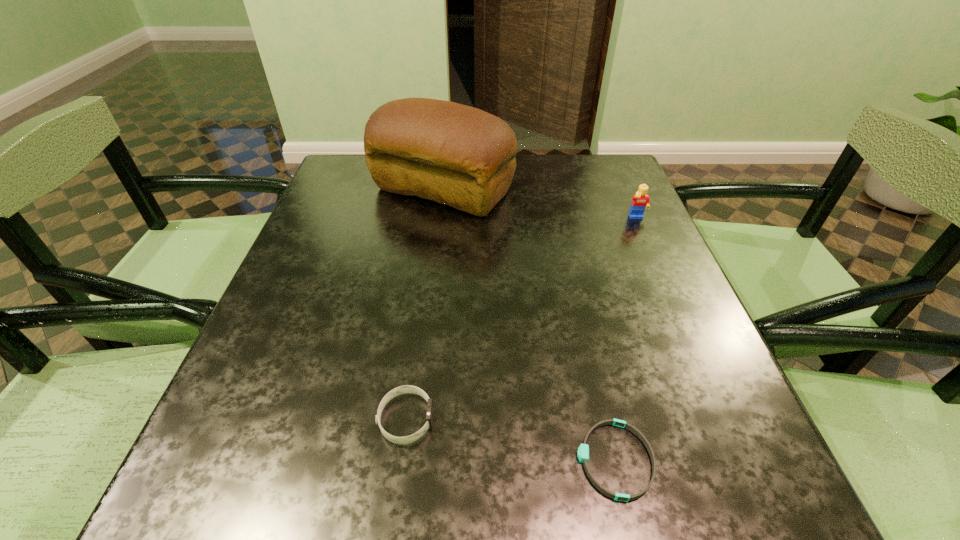
Identify the location of vacant area that lies between the second tallest object and the shorter wristband. The height and width of the screenshot is (540, 960). (626, 339).

Where is `vacant area that lies between the rightmost object and the second object from right to left`? The height and width of the screenshot is (540, 960). vacant area that lies between the rightmost object and the second object from right to left is located at coordinates (626, 339).

At what (x,y) coordinates should I click in order to perform the action: click on unoccupied area between the right wristband and the tallest object. Please return your answer as a coordinate pair (x, y). Looking at the image, I should click on (529, 325).

Locate an element on the screen. Image resolution: width=960 pixels, height=540 pixels. the closest object relative to the left wristband is located at coordinates (583, 451).

Identify which object is located as the nearest to the taller wristband. Please provide its 2D coordinates. Your answer should be formatted as a tuple, i.e. [(x, y)], where the tuple contains the x and y coordinates of a point satisfying the conditions above.

[(583, 451)]

Where is `free space in the image that satisfies the following two spatial constraints: 1. on the face of the third shortest object; 2. on the outer surface of the taller wristband`? Image resolution: width=960 pixels, height=540 pixels. free space in the image that satisfies the following two spatial constraints: 1. on the face of the third shortest object; 2. on the outer surface of the taller wristband is located at coordinates (726, 419).

This screenshot has height=540, width=960. I want to click on free point that satisfies the following two spatial constraints: 1. on the face of the second tallest object; 2. on the outer surface of the taller wristband, so click(x=726, y=419).

Locate an element on the screen. This screenshot has height=540, width=960. vacant region that satisfies the following two spatial constraints: 1. on the face of the Lego; 2. on the buckle of the shorter wristband is located at coordinates 744,460.